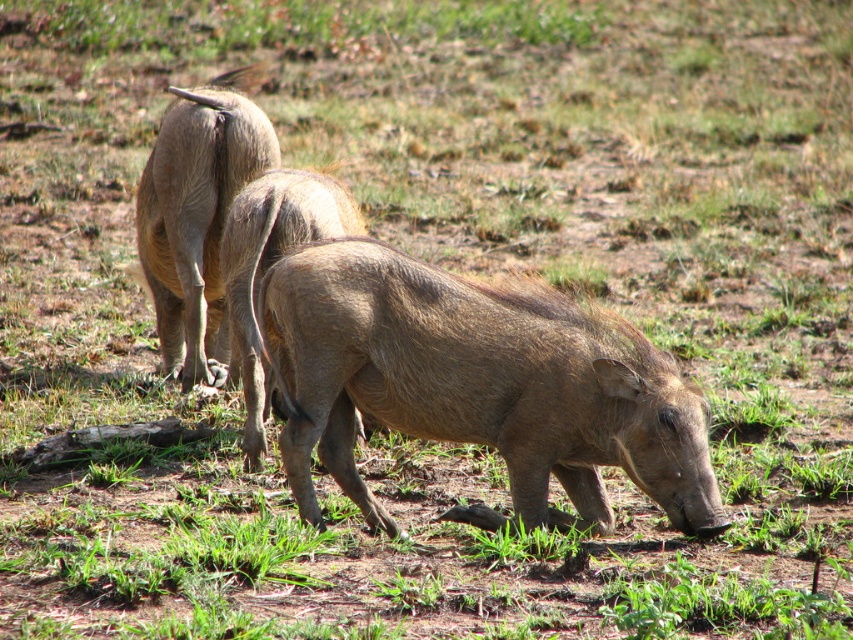
Question: Which point is closer to the camera?

Choices:
 (A) brown rough skin at center
 (B) brown textured pig at center

Answer: (B)

Question: Which of these objects is positioned closest to the brown textured pig at center?

Choices:
 (A) brown rough skin at center
 (B) brown rough skin at upper left

Answer: (A)

Question: Which of the following is the farthest from the observer?

Choices:
 (A) (204, 356)
 (B) (323, 204)

Answer: (A)

Question: Is brown textured pig at center above brown rough skin at upper left?

Choices:
 (A) yes
 (B) no

Answer: (B)

Question: Is brown rough skin at upper left positioned behind brown rough skin at center?

Choices:
 (A) no
 (B) yes

Answer: (B)

Question: In this image, where is brown textured pig at center located relative to brown rough skin at center?

Choices:
 (A) right
 (B) left

Answer: (A)